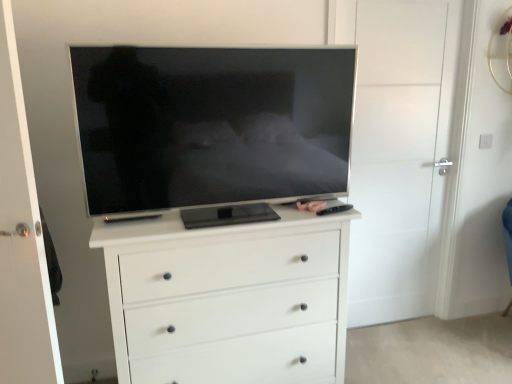
What do you see at coordinates (211, 125) in the screenshot?
I see `matte black tv at center` at bounding box center [211, 125].

Find the location of a particular element. white matte chest of drawers at center is located at coordinates (229, 299).

The height and width of the screenshot is (384, 512). What do you see at coordinates (229, 299) in the screenshot?
I see `white matte chest of drawers at center` at bounding box center [229, 299].

Image resolution: width=512 pixels, height=384 pixels. What do you see at coordinates (311, 205) in the screenshot?
I see `matte black remote control at center` at bounding box center [311, 205].

Measure the distance between point (372, 107) and camera.

2.33 meters.

Find the location of a particular element. black plastic remote at right is located at coordinates (334, 209).

Which of these two, white matte door at center, placed as the 2th door when sorted from back to front, or matte black tv at center, stands shorter?

matte black tv at center is shorter.

Which is farther, [30,297] or [314,191]?

Positioned behind is point [314,191].

In the scene shown: Is white matte door at center, placed as the 2th door when sorted from back to front, further to the viewer compared to matte black tv at center?

No, the depth of white matte door at center, placed as the 2th door when sorted from back to front, is less than that of matte black tv at center.

Does white matte door at center, the 1th door from the front, turn towards matte black tv at center?

No, white matte door at center, the 1th door from the front, is not aimed at matte black tv at center.

Is matte black tv at center not within matte black remote control at center?

matte black tv at center is positioned outside matte black remote control at center.

The width and height of the screenshot is (512, 384). In order to click on person below the matte black tv at center (from a real-world perspective) in this screenshot , I will do `click(311, 205)`.

Can you confirm if matte black tv at center is bigger than matte black remote control at center?

Yes.

Is matte black tv at center oriented towards matte black remote control at center?

No, matte black tv at center is not oriented towards matte black remote control at center.

Between white matte chest of drawers at center and black plastic remote at right, which one has more height?

Standing taller between the two is white matte chest of drawers at center.

Based on their positions, is white matte chest of drawers at center located to the left or right of black plastic remote at right?

white matte chest of drawers at center is to the left of black plastic remote at right.

Is white matte chest of drawers at center not close to black plastic remote at right?

white matte chest of drawers at center is near black plastic remote at right, not far away.

From the image's perspective, is white matte chest of drawers at center on top of black plastic remote at right?

Incorrect, from the image's perspective, white matte chest of drawers at center is lower than black plastic remote at right.

From a real-world perspective, is white matte door at center, the 1th door from the front, under white matte chest of drawers at center?

Actually, white matte door at center, the 1th door from the front, is physically above white matte chest of drawers at center in the real world.

Is white matte door at center, the 1th door from the front, inside the boundaries of white matte chest of drawers at center, or outside?

white matte door at center, the 1th door from the front, lies outside white matte chest of drawers at center.

Could you tell me if white matte door at center, placed as the 2th door when sorted from back to front, is turned towards white matte chest of drawers at center?

No, white matte door at center, placed as the 2th door when sorted from back to front, does not turn towards white matte chest of drawers at center.

In terms of size, does white matte door at center, the first door when ordered from left to right, appear bigger or smaller than white matte chest of drawers at center?

In the image, white matte door at center, the first door when ordered from left to right, appears to be smaller than white matte chest of drawers at center.

From a real-world perspective, which object stands above the other?

matte black tv at center.

Is matte black tv at center at the back of black plastic remote at right?

Yes, black plastic remote at right's orientation is away from matte black tv at center.

At what (x,y) coordinates should I click in order to perform the action: click on television on the left side of black plastic remote at right. Please return your answer as a coordinate pair (x, y). This screenshot has width=512, height=384. Looking at the image, I should click on (211, 125).

From the image's perspective, is black plastic remote at right below matte black tv at center?

Yes.

This screenshot has height=384, width=512. What are the coordinates of `door below the white matte door at center, positioned as the 1th door in back-to-front order (from the image's perspective)` in the screenshot? It's located at (21, 237).

Is white matte door at center, the 1th door when ordered from right to left, bigger than white matte door at center, placed as the 2th door when sorted from back to front?

Incorrect, white matte door at center, the 1th door when ordered from right to left, is not larger than white matte door at center, placed as the 2th door when sorted from back to front.

Considering the relative sizes of matte black tv at center and black plastic remote at right in the image provided, is matte black tv at center smaller than black plastic remote at right?

No, matte black tv at center is not smaller than black plastic remote at right.

Is matte black tv at center oriented away from black plastic remote at right?

No, matte black tv at center is not facing the opposite direction of black plastic remote at right.

Locate an element on the screen. remote below the matte black tv at center (from the image's perspective) is located at coordinates (334, 209).

Image resolution: width=512 pixels, height=384 pixels. In order to click on the 2nd door below when counting from the matte black tv at center (from the image's perspective) in this screenshot , I will do `click(21, 237)`.

In order to click on television on the left of matte black remote control at center in this screenshot , I will do `click(211, 125)`.

From the picture: Estimate the real-world distances between objects in this image. Which object is closer to black plastic remote at right, white matte door at center, positioned as the 1th door in back-to-front order, or matte black tv at center?

matte black tv at center is positioned closer to the anchor black plastic remote at right.

Estimate the real-world distances between objects in this image. Which object is further from white matte chest of drawers at center, black plastic remote at right or white matte door at center, which is counted as the second door, starting from the right?

Answer: white matte door at center, which is counted as the second door, starting from the right, is positioned further to the anchor white matte chest of drawers at center.

Based on their spatial positions, is matte black tv at center or black plastic remote at right closer to matte black remote control at center?

black plastic remote at right.

Based on the photo, considering their positions, is matte black remote control at center positioned closer to white matte door at center, the first door when ordered from left to right, than white matte chest of drawers at center?

The object closer to white matte door at center, the first door when ordered from left to right, is white matte chest of drawers at center.

Looking at this image, considering their positions, is white matte chest of drawers at center positioned closer to white matte door at center, the 2th door from the left, than matte black remote control at center?

Based on the image, matte black remote control at center appears to be nearer to white matte door at center, the 2th door from the left.

From the image, which object appears to be farther from white matte door at center, which is counted as the second door, starting from the right, black plastic remote at right or white matte chest of drawers at center?

The object further to white matte door at center, which is counted as the second door, starting from the right, is black plastic remote at right.

Based on their spatial positions, is black plastic remote at right or white matte chest of drawers at center further from matte black tv at center?

Among the two, black plastic remote at right is located further to matte black tv at center.

Estimate the real-world distances between objects in this image. Which object is closer to white matte door at center, the 1th door from the front, matte black remote control at center or white matte door at center, the 1th door when ordered from right to left?

matte black remote control at center is closer to white matte door at center, the 1th door from the front.

Where is `remote that lies between matte black remote control at center and white matte chest of drawers at center from top to bottom`? The image size is (512, 384). remote that lies between matte black remote control at center and white matte chest of drawers at center from top to bottom is located at coordinates (334, 209).

Where is `remote between matte black tv at center and matte black remote control at center from front to back`? The width and height of the screenshot is (512, 384). remote between matte black tv at center and matte black remote control at center from front to back is located at coordinates (334, 209).

What are the coordinates of `the chest of drawers situated between white matte door at center, the 1th door from the front, and black plastic remote at right from left to right` in the screenshot? It's located at (229, 299).

You are a GUI agent. You are given a task and a screenshot of the screen. Output one action in this format:
    pyautogui.click(x=<x>, y=<y>)
    Task: Click on the television situated between white matte door at center, which is counted as the second door, starting from the right, and matte black remote control at center from left to right
    Image resolution: width=512 pixels, height=384 pixels.
    Given the screenshot: What is the action you would take?
    pyautogui.click(x=211, y=125)